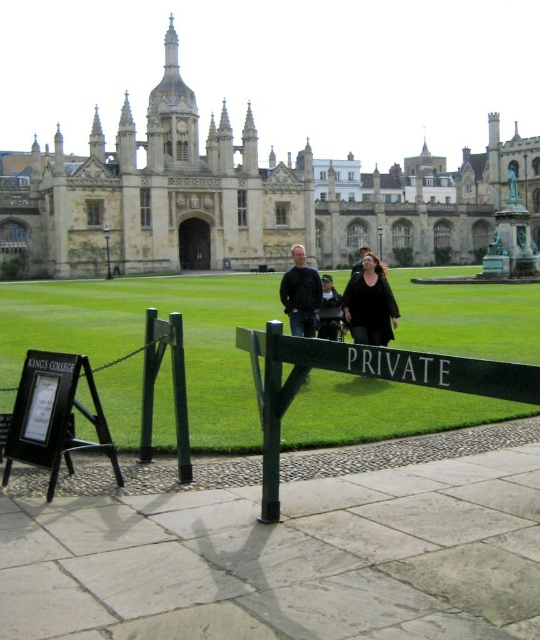
Does stone gothic architecture at center appear under green grass at center?

→ Incorrect, stone gothic architecture at center is not positioned below green grass at center.

Does point (94, 252) lie in front of point (407, 276)?

Yes, it is in front of point (407, 276).

Identify the location of stone gothic architecture at center. Image resolution: width=540 pixels, height=640 pixels. (239, 196).

Measure the distance between point (x=54, y=163) and camera.

Point (x=54, y=163) and camera are 292.73 feet apart from each other.

Which of these two, stone gothic architecture at center or black wood sign at lower left, stands shorter?

With less height is black wood sign at lower left.

Identify the location of stone gothic architecture at center. point(239,196).

Identify the location of stone gothic architecture at center. The image size is (540, 640). (239, 196).

Can you confirm if black sweater at center is taller than matte black jacket at center?

Yes, black sweater at center is taller than matte black jacket at center.

Is point (367, 337) behind point (336, 294)?

No, (367, 337) is closer to viewer.

Which is in front, point (291, 310) or point (341, 323)?

Point (291, 310) is in front.

Identify the location of black sweater at center. (369, 304).